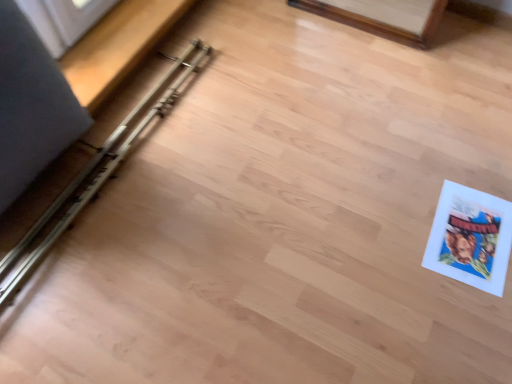
Question: Is metallic silver rail at left outside white paper comic book at lower right?

Choices:
 (A) no
 (B) yes

Answer: (B)

Question: Does metallic silver rail at left appear on the right side of white paper comic book at lower right?

Choices:
 (A) yes
 (B) no

Answer: (B)

Question: From the image's perspective, would you say metallic silver rail at left is shown under white paper comic book at lower right?

Choices:
 (A) no
 (B) yes

Answer: (A)

Question: Considering the relative sizes of metallic silver rail at left and white paper comic book at lower right in the image provided, is metallic silver rail at left wider than white paper comic book at lower right?

Choices:
 (A) yes
 (B) no

Answer: (A)

Question: Is metallic silver rail at left taller than white paper comic book at lower right?

Choices:
 (A) no
 (B) yes

Answer: (B)

Question: Is metallic silver rail at left positioned before white paper comic book at lower right?

Choices:
 (A) yes
 (B) no

Answer: (A)

Question: From a real-world perspective, is white paper comic book at lower right on top of metallic silver rail at left?

Choices:
 (A) yes
 (B) no

Answer: (B)

Question: Can you confirm if white paper comic book at lower right is taller than metallic silver rail at left?

Choices:
 (A) yes
 (B) no

Answer: (B)

Question: From the image's perspective, is white paper comic book at lower right located beneath metallic silver rail at left?

Choices:
 (A) yes
 (B) no

Answer: (A)

Question: Can you confirm if white paper comic book at lower right is positioned to the left of metallic silver rail at left?

Choices:
 (A) no
 (B) yes

Answer: (A)

Question: Is white paper comic book at lower right outside of metallic silver rail at left?

Choices:
 (A) no
 (B) yes

Answer: (B)

Question: Considering the relative sizes of white paper comic book at lower right and metallic silver rail at left in the image provided, is white paper comic book at lower right shorter than metallic silver rail at left?

Choices:
 (A) yes
 (B) no

Answer: (A)

Question: From the image's perspective, is white paper comic book at lower right above or below metallic silver rail at left?

Choices:
 (A) below
 (B) above

Answer: (A)